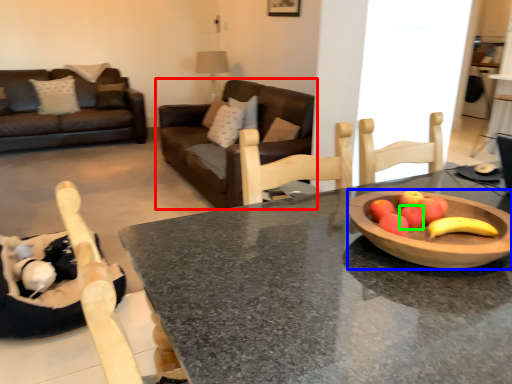
Question: Which object is positioned farthest from studio couch (highlighted by a red box)? Select from bowl (highlighted by a blue box) and apple (highlighted by a green box).

Choices:
 (A) bowl
 (B) apple

Answer: (B)